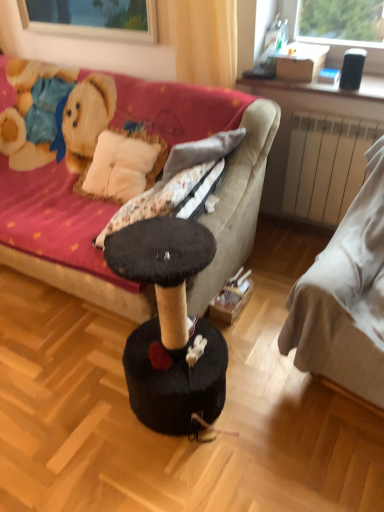
The image size is (384, 512). Identify the location of velvet fabric couch at center, which is the 2th studio couch from right to left. (64, 240).

What do you see at coordinates (64, 240) in the screenshot?
I see `velvet fabric couch at center, which is the 2th studio couch from right to left` at bounding box center [64, 240].

At what (x,y) coordinates should I click in order to perform the action: click on yellow fabric curtain at upper center. Please return your answer as a coordinate pair (x, y). This screenshot has width=384, height=512. Looking at the image, I should click on (204, 40).

Locate an element on the screen. transparent glass window at upper center is located at coordinates (92, 18).

Who is more distant, yellow fabric curtain at upper center or velvet fabric couch at center, which is the 2th studio couch from right to left?

yellow fabric curtain at upper center.

From the picture: Who is bigger, yellow fabric curtain at upper center or velvet fabric couch at center, which is the 2th studio couch from right to left?

velvet fabric couch at center, which is the 2th studio couch from right to left.

This screenshot has height=512, width=384. There is a yellow fabric curtain at upper center. What are the coordinates of `the 2nd studio couch below it (from a real-world perspective)` in the screenshot? It's located at (64, 240).

From a real-world perspective, is white fabric bed at right, acting as the first studio couch starting from the right, positioned under velvet fabric couch at center, which is the 2th studio couch from right to left, based on gravity?

Incorrect, from a real-world perspective, white fabric bed at right, acting as the first studio couch starting from the right, is higher than velvet fabric couch at center, which is the 2th studio couch from right to left.

How distant is white fabric bed at right, acting as the first studio couch starting from the right, from velvet fabric couch at center, positioned as the first studio couch in left-to-right order?

27.32 inches.

Based on their sizes in the image, would you say white fabric bed at right, acting as the first studio couch starting from the right, is bigger or smaller than velvet fabric couch at center, positioned as the first studio couch in left-to-right order?

Clearly, white fabric bed at right, acting as the first studio couch starting from the right, is smaller in size than velvet fabric couch at center, positioned as the first studio couch in left-to-right order.

Is velvet fabric couch at center, positioned as the first studio couch in left-to-right order, wider than transparent glass window at upper center?

Yes, velvet fabric couch at center, positioned as the first studio couch in left-to-right order, is wider than transparent glass window at upper center.

From the image's perspective, count 1st studio couchs downward from the transparent glass window at upper center and point to it. Please provide its 2D coordinates.

[(64, 240)]

Can you see velvet fabric couch at center, positioned as the first studio couch in left-to-right order, touching transparent glass window at upper center?

They are not placed beside each other.

From the image's perspective, is yellow fabric curtain at upper center located above or below white fabric bed at right, which is the 2th studio couch in left-to-right order?

yellow fabric curtain at upper center is situated higher than white fabric bed at right, which is the 2th studio couch in left-to-right order, in the image.

Can you confirm if yellow fabric curtain at upper center is positioned to the left of white fabric bed at right, acting as the first studio couch starting from the right?

Indeed, yellow fabric curtain at upper center is positioned on the left side of white fabric bed at right, acting as the first studio couch starting from the right.

I want to click on the 1st studio couch below the yellow fabric curtain at upper center (from a real-world perspective), so click(x=345, y=297).

Between yellow fabric curtain at upper center and white matte radiator at right, which one has more height?

With more height is white matte radiator at right.

Looking at this image, looking at their sizes, would you say yellow fabric curtain at upper center is wider or thinner than white matte radiator at right?

Considering their sizes, yellow fabric curtain at upper center looks broader than white matte radiator at right.

Can you confirm if yellow fabric curtain at upper center is positioned to the right of white matte radiator at right?

In fact, yellow fabric curtain at upper center is to the left of white matte radiator at right.

Is yellow fabric curtain at upper center positioned beyond the bounds of white matte radiator at right?

Absolutely, yellow fabric curtain at upper center is external to white matte radiator at right.

Is transparent glass window at upper center taller than white fabric bed at right, acting as the first studio couch starting from the right?

No.

Considering the positions of objects transparent glass window at upper center and white fabric bed at right, which is the 2th studio couch in left-to-right order, in the image provided, who is more to the left, transparent glass window at upper center or white fabric bed at right, which is the 2th studio couch in left-to-right order,?

transparent glass window at upper center is more to the left.

Is transparent glass window at upper center next to white fabric bed at right, acting as the first studio couch starting from the right?

There is a gap between transparent glass window at upper center and white fabric bed at right, acting as the first studio couch starting from the right.

Is point (144, 19) positioned after point (381, 396)?

That is True.

Considering the relative sizes of white fabric bed at right, which is the 2th studio couch in left-to-right order, and transparent glass window at upper center in the image provided, is white fabric bed at right, which is the 2th studio couch in left-to-right order, shorter than transparent glass window at upper center?

Incorrect, the height of white fabric bed at right, which is the 2th studio couch in left-to-right order, does not fall short of that of transparent glass window at upper center.

Is white fabric bed at right, which is the 2th studio couch in left-to-right order, oriented away from transparent glass window at upper center?

white fabric bed at right, which is the 2th studio couch in left-to-right order, does not have its back to transparent glass window at upper center.

How many degrees apart are the facing directions of white fabric bed at right, which is the 2th studio couch in left-to-right order, and transparent glass window at upper center?

9.13 degrees.

Is white fabric bed at right, which is the 2th studio couch in left-to-right order, further to the viewer compared to transparent glass window at upper center?

No, it is not.

Identify the location of the 1st studio couch positioned below the yellow fabric curtain at upper center (from the image's perspective). (64, 240).

The image size is (384, 512). Find the location of `studio couch in front of the velvet fabric couch at center, which is the 2th studio couch from right to left`. studio couch in front of the velvet fabric couch at center, which is the 2th studio couch from right to left is located at coordinates (345, 297).

When comparing their distances from white fabric bed at right, acting as the first studio couch starting from the right, does yellow fabric curtain at upper center or white matte radiator at right seem further?

yellow fabric curtain at upper center lies further to white fabric bed at right, acting as the first studio couch starting from the right, than the other object.

Estimate the real-world distances between objects in this image. Which object is closer to velvet fabric couch at center, positioned as the first studio couch in left-to-right order, transparent glass window at upper center or white fabric bed at right, acting as the first studio couch starting from the right?

Based on the image, white fabric bed at right, acting as the first studio couch starting from the right, appears to be nearer to velvet fabric couch at center, positioned as the first studio couch in left-to-right order.

When comparing their distances from velvet fabric couch at center, positioned as the first studio couch in left-to-right order, does white matte radiator at right or white fabric bed at right, which is the 2th studio couch in left-to-right order, seem further?

white fabric bed at right, which is the 2th studio couch in left-to-right order.

From the picture: Estimate the real-world distances between objects in this image. Which object is further from yellow fabric curtain at upper center, white fabric bed at right, which is the 2th studio couch in left-to-right order, or velvet fabric couch at center, which is the 2th studio couch from right to left?

white fabric bed at right, which is the 2th studio couch in left-to-right order, lies further to yellow fabric curtain at upper center than the other object.

Looking at this image, when comparing their distances from velvet fabric couch at center, which is the 2th studio couch from right to left, does white fabric bed at right, which is the 2th studio couch in left-to-right order, or transparent glass window at upper center seem further?

The object further to velvet fabric couch at center, which is the 2th studio couch from right to left, is transparent glass window at upper center.

Looking at the image, which one is located further to yellow fabric curtain at upper center, white matte radiator at right or transparent glass window at upper center?

Based on the image, white matte radiator at right appears to be further to yellow fabric curtain at upper center.

Looking at the image, which one is located closer to yellow fabric curtain at upper center, white fabric bed at right, acting as the first studio couch starting from the right, or white matte radiator at right?

white matte radiator at right is closer to yellow fabric curtain at upper center.

Considering their positions, is white fabric bed at right, acting as the first studio couch starting from the right, positioned further to transparent glass window at upper center than velvet fabric couch at center, positioned as the first studio couch in left-to-right order?

Based on the image, white fabric bed at right, acting as the first studio couch starting from the right, appears to be further to transparent glass window at upper center.

Find the location of a particular element. The height and width of the screenshot is (512, 384). curtain between white fabric bed at right, acting as the first studio couch starting from the right, and white matte radiator at right in the front-back direction is located at coordinates (204, 40).

Locate an element on the screen. This screenshot has height=512, width=384. window screen between velvet fabric couch at center, positioned as the first studio couch in left-to-right order, and white fabric bed at right, which is the 2th studio couch in left-to-right order is located at coordinates (92, 18).

Locate an element on the screen. The width and height of the screenshot is (384, 512). radiator located between transparent glass window at upper center and white fabric bed at right, acting as the first studio couch starting from the right, in the left-right direction is located at coordinates (326, 164).

This screenshot has width=384, height=512. I want to click on curtain between transparent glass window at upper center and white fabric bed at right, acting as the first studio couch starting from the right, from top to bottom, so click(204, 40).